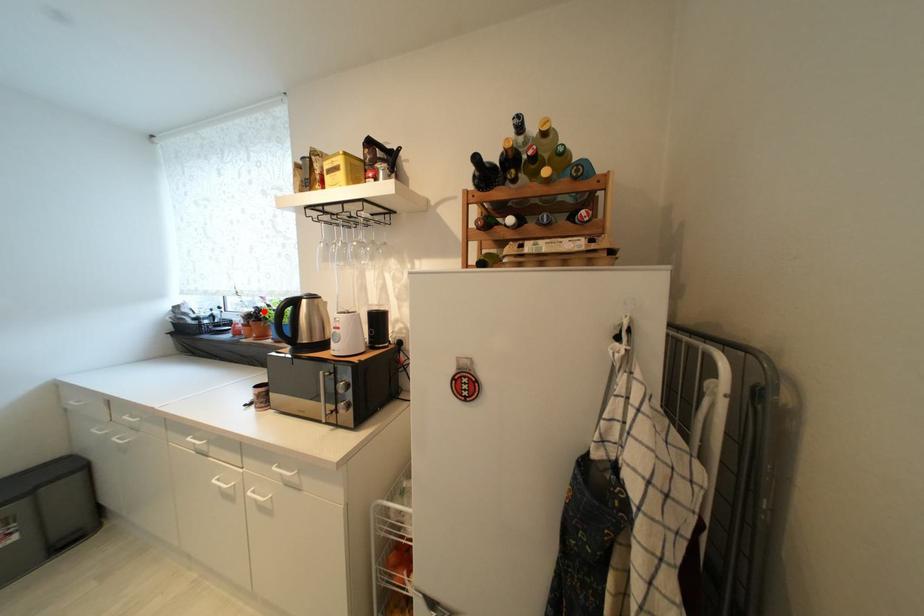
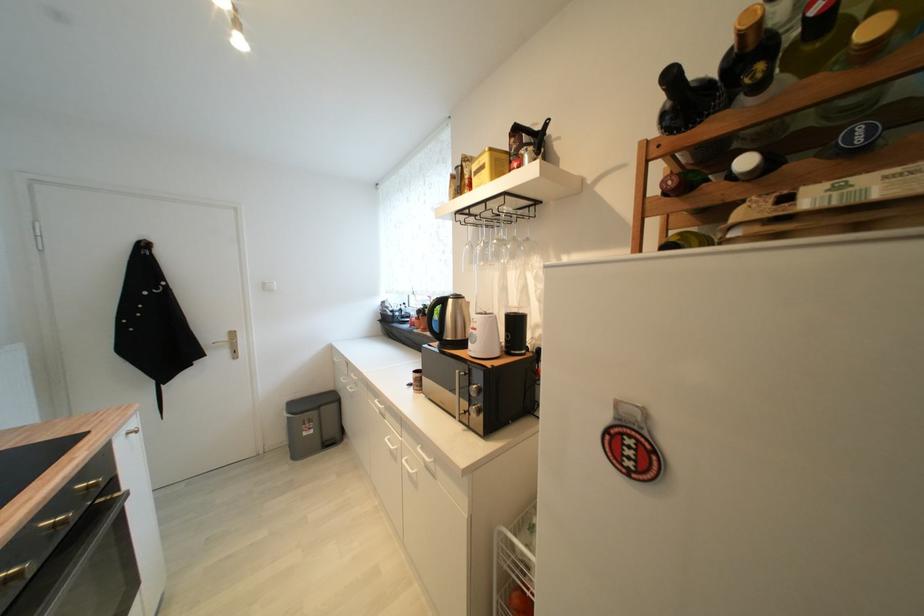
Where in the second image is the point corresponding to the highlighted location from the first image?

(431, 309)